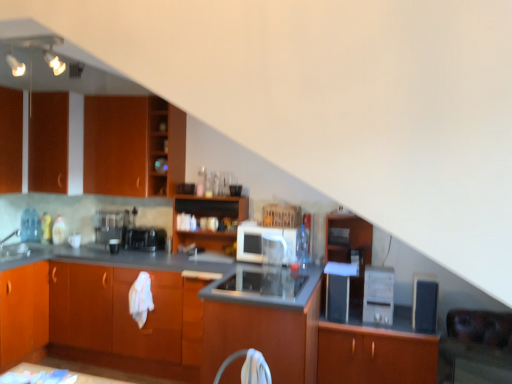
Question: Is wooden shelves at upper left wider than white glossy microwave at center, the 3th appliance viewed from the left?

Choices:
 (A) no
 (B) yes

Answer: (A)

Question: From a real-world perspective, is wooden shelves at upper left positioned under white glossy microwave at center, the 3th appliance viewed from the left, based on gravity?

Choices:
 (A) no
 (B) yes

Answer: (A)

Question: Is wooden shelves at upper left positioned before white glossy microwave at center, the third appliance viewed from the right?

Choices:
 (A) yes
 (B) no

Answer: (B)

Question: Does wooden shelves at upper left come behind white glossy microwave at center, the third appliance viewed from the right?

Choices:
 (A) no
 (B) yes

Answer: (B)

Question: From the image's perspective, is wooden shelves at upper left on white glossy microwave at center, the third appliance viewed from the right?

Choices:
 (A) no
 (B) yes

Answer: (B)

Question: Considering the positions of point (158, 127) and point (267, 294), is point (158, 127) closer or farther from the camera than point (267, 294)?

Choices:
 (A) closer
 (B) farther

Answer: (B)

Question: Is wooden shelves at upper left inside the boundaries of sleek stainless steel stove at center, positioned as the second appliance in left-to-right order, or outside?

Choices:
 (A) inside
 (B) outside

Answer: (B)

Question: In the image, is wooden shelves at upper left on the left side or the right side of sleek stainless steel stove at center, which is counted as the fourth appliance, starting from the right?

Choices:
 (A) left
 (B) right

Answer: (A)

Question: In the image, is wooden shelves at upper left positioned in front of or behind sleek stainless steel stove at center, which is counted as the fourth appliance, starting from the right?

Choices:
 (A) behind
 (B) front

Answer: (A)

Question: From a real-world perspective, is matte black microwave at center, which ranks as the 1th appliance in right-to-left order, positioned above or below wooden cabinet at center, placed as the 4th appliance when sorted from left to right?

Choices:
 (A) below
 (B) above

Answer: (A)

Question: Would you say matte black microwave at center, acting as the fifth appliance starting from the left, is to the left or to the right of wooden cabinet at center, which appears as the 2th appliance when viewed from the right, in the picture?

Choices:
 (A) left
 (B) right

Answer: (B)

Question: Considering the positions of matte black microwave at center, which ranks as the 1th appliance in right-to-left order, and wooden cabinet at center, placed as the 4th appliance when sorted from left to right, in the image, is matte black microwave at center, which ranks as the 1th appliance in right-to-left order, taller or shorter than wooden cabinet at center, placed as the 4th appliance when sorted from left to right,?

Choices:
 (A) short
 (B) tall

Answer: (A)

Question: Considering the positions of point (430, 289) and point (362, 309), is point (430, 289) closer or farther from the camera than point (362, 309)?

Choices:
 (A) farther
 (B) closer

Answer: (B)

Question: Is wooden cabinet at center, placed as the 4th appliance when sorted from left to right, to the left or to the right of wooden file cabinet at center in the image?

Choices:
 (A) right
 (B) left

Answer: (A)

Question: Considering the positions of wooden cabinet at center, which appears as the 2th appliance when viewed from the right, and wooden file cabinet at center in the image, is wooden cabinet at center, which appears as the 2th appliance when viewed from the right, wider or thinner than wooden file cabinet at center?

Choices:
 (A) wide
 (B) thin

Answer: (B)